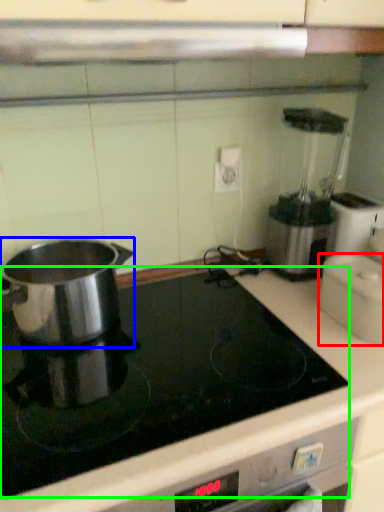
Question: Considering the real-world distances, which object is farthest from kitchen appliance (highlighted by a red box)? kitchen appliance (highlighted by a blue box) or kitchen appliance (highlighted by a green box)?

Choices:
 (A) kitchen appliance
 (B) kitchen appliance

Answer: (A)